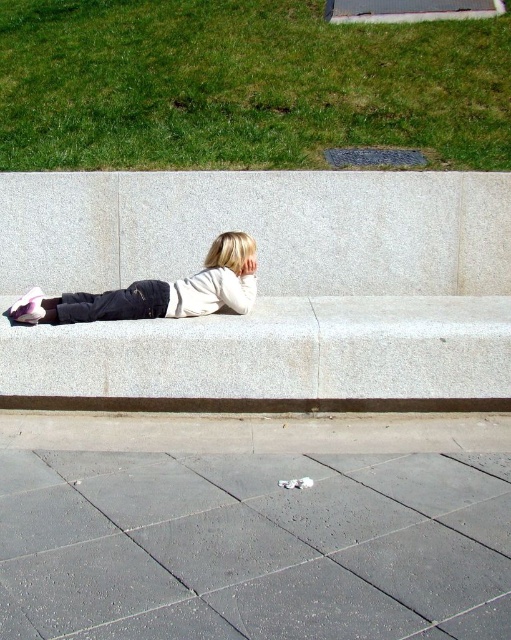
Question: Which point appears closest to the camera in this image?

Choices:
 (A) (61, 234)
 (B) (114, 44)
 (C) (230, 406)
 (D) (175, 298)

Answer: (C)

Question: Which point is farther from the camera taking this photo?

Choices:
 (A) (201, 308)
 (B) (96, 157)
 (C) (234, 564)

Answer: (B)

Question: Is gray granite bench at center thinner than green grass at upper left?

Choices:
 (A) no
 (B) yes

Answer: (B)

Question: Can you confirm if gray concrete pavement at lower center is positioned to the left of brown textured curb at lower center?

Choices:
 (A) no
 (B) yes

Answer: (B)

Question: Which of the following is the closest to the observer?

Choices:
 (A) green grass at upper left
 (B) matte white shirt at center
 (C) gray concrete pavement at lower center

Answer: (C)

Question: Is gray granite bench at center thinner than gray concrete pavement at lower center?

Choices:
 (A) no
 (B) yes

Answer: (A)